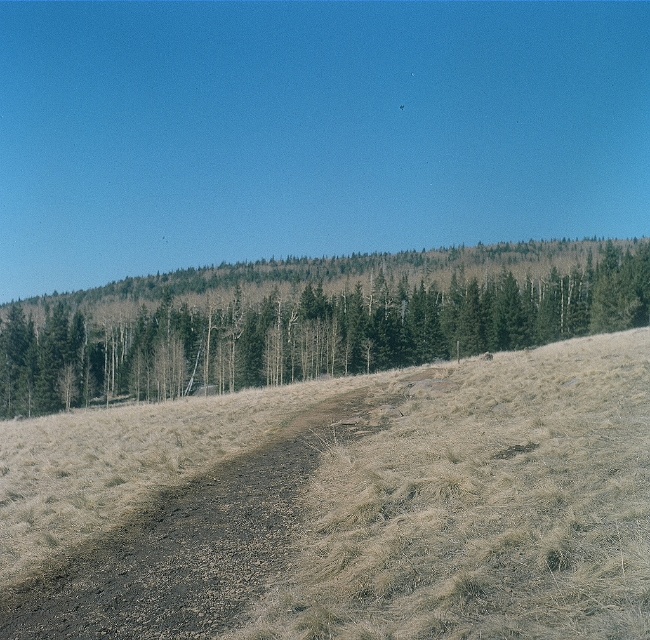
Question: Among these objects, which one is nearest to the camera?

Choices:
 (A) brown dirt track at center
 (B) green matte trees at upper center

Answer: (A)

Question: Is green matte trees at upper center positioned in front of brown dirt track at center?

Choices:
 (A) yes
 (B) no

Answer: (B)

Question: From the image, what is the correct spatial relationship of green matte trees at upper center in relation to brown dirt track at center?

Choices:
 (A) above
 (B) below

Answer: (A)

Question: Is green matte trees at upper center to the left of brown dirt track at center from the viewer's perspective?

Choices:
 (A) yes
 (B) no

Answer: (B)